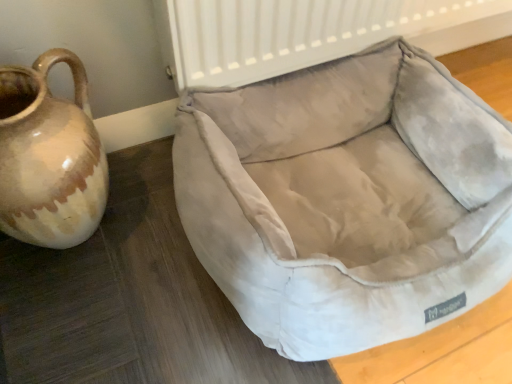
Question: Should I look upward or downward to see brown glazed jug at left?

Choices:
 (A) down
 (B) up

Answer: (B)

Question: Can you confirm if suede-like beige dog bed at center is wider than brown glazed jug at left?

Choices:
 (A) yes
 (B) no

Answer: (A)

Question: Is suede-like beige dog bed at center next to brown glazed jug at left and touching it?

Choices:
 (A) no
 (B) yes

Answer: (A)

Question: From the image's perspective, does suede-like beige dog bed at center appear higher than brown glazed jug at left?

Choices:
 (A) yes
 (B) no

Answer: (B)

Question: Would you say brown glazed jug at left is part of suede-like beige dog bed at center's contents?

Choices:
 (A) yes
 (B) no

Answer: (B)

Question: Considering the relative positions of suede-like beige dog bed at center and brown glazed jug at left in the image provided, is suede-like beige dog bed at center to the right of brown glazed jug at left from the viewer's perspective?

Choices:
 (A) no
 (B) yes

Answer: (B)

Question: Is suede-like beige dog bed at center smaller than brown glazed jug at left?

Choices:
 (A) yes
 (B) no

Answer: (B)

Question: Are brown glazed jug at left and suede-like beige dog bed at center far apart?

Choices:
 (A) no
 (B) yes

Answer: (A)

Question: Is brown glazed jug at left touching suede-like beige dog bed at center?

Choices:
 (A) no
 (B) yes

Answer: (A)

Question: From the image's perspective, is brown glazed jug at left located beneath suede-like beige dog bed at center?

Choices:
 (A) yes
 (B) no

Answer: (B)

Question: Does brown glazed jug at left have a smaller size compared to suede-like beige dog bed at center?

Choices:
 (A) no
 (B) yes

Answer: (B)

Question: Can you confirm if brown glazed jug at left is bigger than suede-like beige dog bed at center?

Choices:
 (A) no
 (B) yes

Answer: (A)

Question: From a real-world perspective, is brown glazed jug at left on top of suede-like beige dog bed at center?

Choices:
 (A) no
 (B) yes

Answer: (B)

Question: Is brown glazed jug at left situated inside suede-like beige dog bed at center or outside?

Choices:
 (A) inside
 (B) outside

Answer: (B)